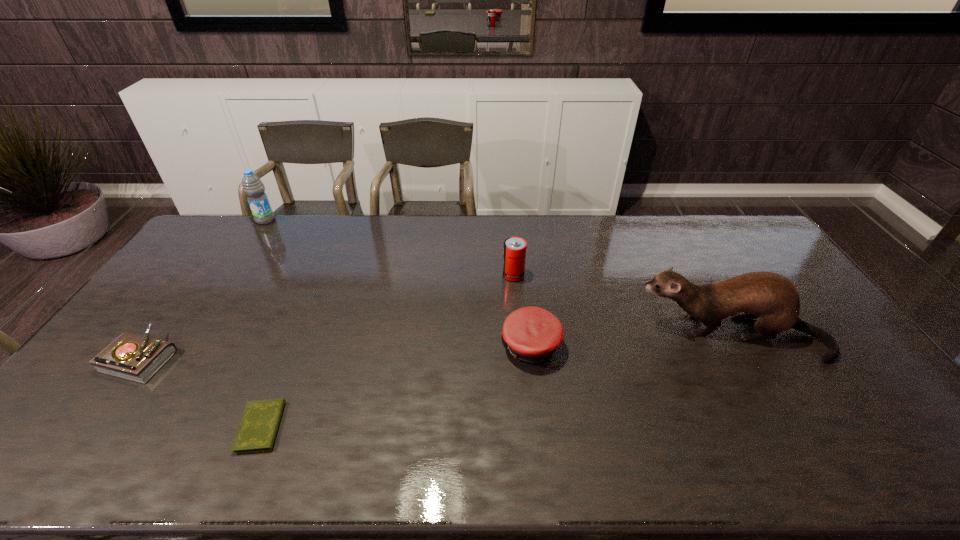
Where is `water bottle`? The image size is (960, 540). water bottle is located at coordinates (253, 187).

You are a GUI agent. You are given a task and a screenshot of the screen. Output one action in this format:
    pyautogui.click(x=<x>, y=<y>)
    Task: Click on the ferret
    
    Given the screenshot: What is the action you would take?
    pyautogui.click(x=772, y=299)

The width and height of the screenshot is (960, 540). I want to click on the fifth nearest object, so click(514, 253).

What are the coordinates of `can` in the screenshot? It's located at (514, 253).

Image resolution: width=960 pixels, height=540 pixels. In order to click on the fourth tallest object in this screenshot , I will do `click(532, 334)`.

Locate an element on the screen. Image resolution: width=960 pixels, height=540 pixels. the left diary is located at coordinates (133, 357).

The height and width of the screenshot is (540, 960). Identify the location of the taller diary. (133, 357).

You are a GUI agent. You are given a task and a screenshot of the screen. Output one action in this format:
    pyautogui.click(x=<x>, y=<y>)
    Task: Click on the third object from left to right
    The width and height of the screenshot is (960, 540).
    Given the screenshot: What is the action you would take?
    pyautogui.click(x=258, y=427)

Where is `the shorter diary`? the shorter diary is located at coordinates (258, 427).

Find the location of a particular element. free space located 0.290m on the front of the farthest object is located at coordinates (230, 274).